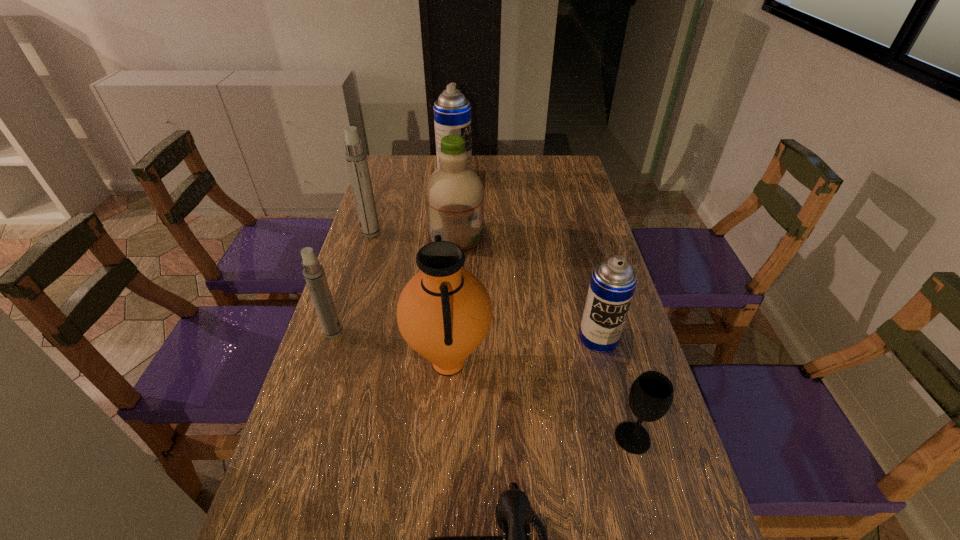
The height and width of the screenshot is (540, 960). What are the coordinates of `the third nearest aerosol can` in the screenshot? It's located at (356, 158).

At what (x,y) coordinates should I click in order to perform the action: click on the farther white aerosol can. Please return your answer as a coordinate pair (x, y). Image resolution: width=960 pixels, height=540 pixels. Looking at the image, I should click on (356, 158).

The width and height of the screenshot is (960, 540). What are the coordinates of `the left blue aerosol can` in the screenshot? It's located at (452, 111).

The height and width of the screenshot is (540, 960). Identify the location of the bigger blue aerosol can. click(x=452, y=111).

Find the location of `cleansing agent`. cleansing agent is located at coordinates (454, 193).

Image resolution: width=960 pixels, height=540 pixels. Identify the location of pitcher. (444, 312).

What are the coordinates of `the nearer white aerosol can` in the screenshot? It's located at (313, 271).

This screenshot has height=540, width=960. I want to click on the right blue aerosol can, so click(613, 281).

The height and width of the screenshot is (540, 960). I want to click on the smaller blue aerosol can, so click(x=613, y=281).

What are the coordinates of `the seventh farthest object` in the screenshot? It's located at (651, 395).